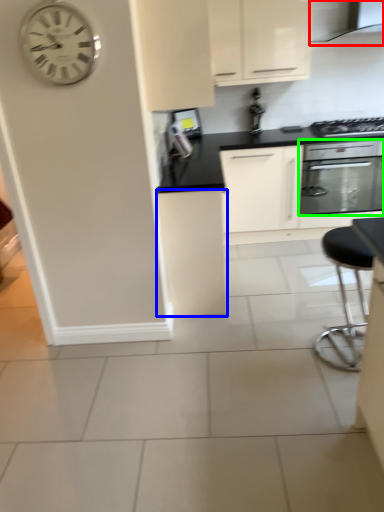
Question: Which is nearer to the exhaust hood (highlighted by a red box)? cabinetry (highlighted by a blue box) or home appliance (highlighted by a green box).

Choices:
 (A) cabinetry
 (B) home appliance

Answer: (B)